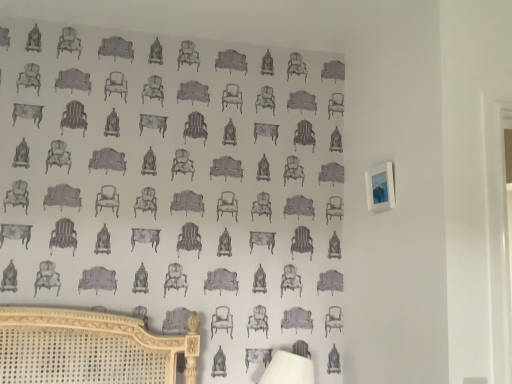
Question: Does white fabric table lamp at lower center appear on the right side of blue glossy picture frame at upper right?

Choices:
 (A) yes
 (B) no

Answer: (B)

Question: Is white fabric table lamp at lower center facing away from blue glossy picture frame at upper right?

Choices:
 (A) yes
 (B) no

Answer: (B)

Question: From a real-world perspective, is white fabric table lamp at lower center located beneath blue glossy picture frame at upper right?

Choices:
 (A) yes
 (B) no

Answer: (A)

Question: Can blue glossy picture frame at upper right be found inside white fabric table lamp at lower center?

Choices:
 (A) yes
 (B) no

Answer: (B)

Question: Is white fabric table lamp at lower center taller than blue glossy picture frame at upper right?

Choices:
 (A) no
 (B) yes

Answer: (B)

Question: Does white fabric table lamp at lower center have a larger size compared to blue glossy picture frame at upper right?

Choices:
 (A) no
 (B) yes

Answer: (B)

Question: Is blue glossy picture frame at upper right located outside white fabric table lamp at lower center?

Choices:
 (A) yes
 (B) no

Answer: (A)

Question: Is blue glossy picture frame at upper right with white fabric table lamp at lower center?

Choices:
 (A) no
 (B) yes

Answer: (A)

Question: From a real-world perspective, is blue glossy picture frame at upper right under white fabric table lamp at lower center?

Choices:
 (A) yes
 (B) no

Answer: (B)

Question: Does blue glossy picture frame at upper right have a greater width compared to white fabric table lamp at lower center?

Choices:
 (A) no
 (B) yes

Answer: (A)

Question: Is blue glossy picture frame at upper right not close to white fabric table lamp at lower center?

Choices:
 (A) yes
 (B) no

Answer: (B)

Question: Is blue glossy picture frame at upper right to the left of white fabric table lamp at lower center from the viewer's perspective?

Choices:
 (A) no
 (B) yes

Answer: (A)

Question: Considering the positions of blue glossy picture frame at upper right and white fabric table lamp at lower center in the image, is blue glossy picture frame at upper right taller or shorter than white fabric table lamp at lower center?

Choices:
 (A) short
 (B) tall

Answer: (A)